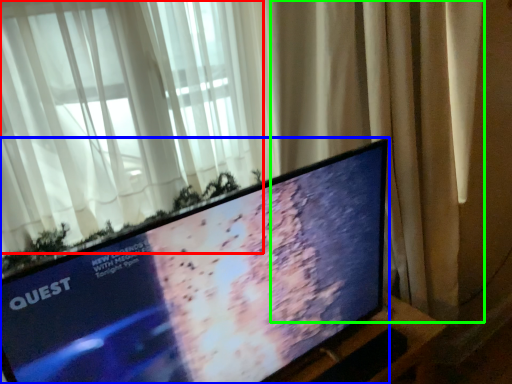
Question: Which object is positioned farthest from curtain (highlighted by a red box)? Select from television (highlighted by a blue box) and curtain (highlighted by a green box).

Choices:
 (A) television
 (B) curtain

Answer: (A)